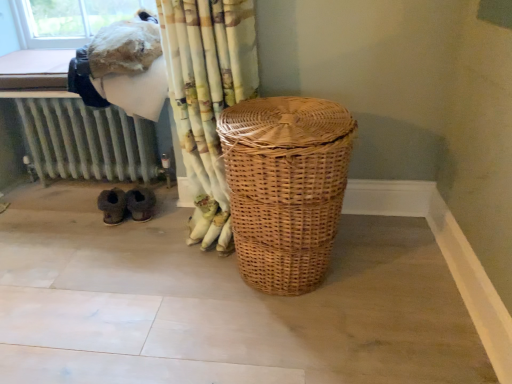
Locate an element on the screen. vacant space to the right of woven brown laundry basket at center is located at coordinates (395, 273).